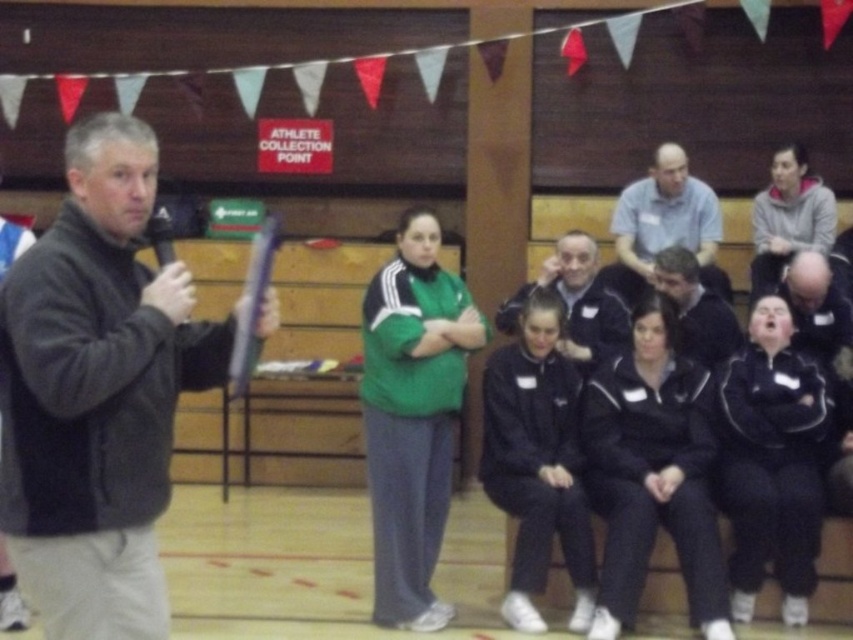
Question: Is light blue shirt at upper center behind dark blue jacket at center?

Choices:
 (A) yes
 (B) no

Answer: (A)

Question: Which object appears farthest from the camera in this image?

Choices:
 (A) black matte jacket at left
 (B) light blue shirt at upper center
 (C) dark gray jacket at center
 (D) dark blue jacket at center

Answer: (B)

Question: Which is nearer to the black matte jacket at left?

Choices:
 (A) light blue shirt at upper center
 (B) dark blue jacket at center
 (C) dark gray jacket at center

Answer: (B)

Question: Which point is closer to the camera?

Choices:
 (A) black matte jacket at left
 (B) dark blue jacket at center
 (C) light blue shirt at upper center

Answer: (A)

Question: Can you confirm if black matte jacket at left is smaller than light blue shirt at upper center?

Choices:
 (A) yes
 (B) no

Answer: (A)

Question: Does black matte jacket at left appear on the left side of light blue shirt at upper center?

Choices:
 (A) no
 (B) yes

Answer: (B)